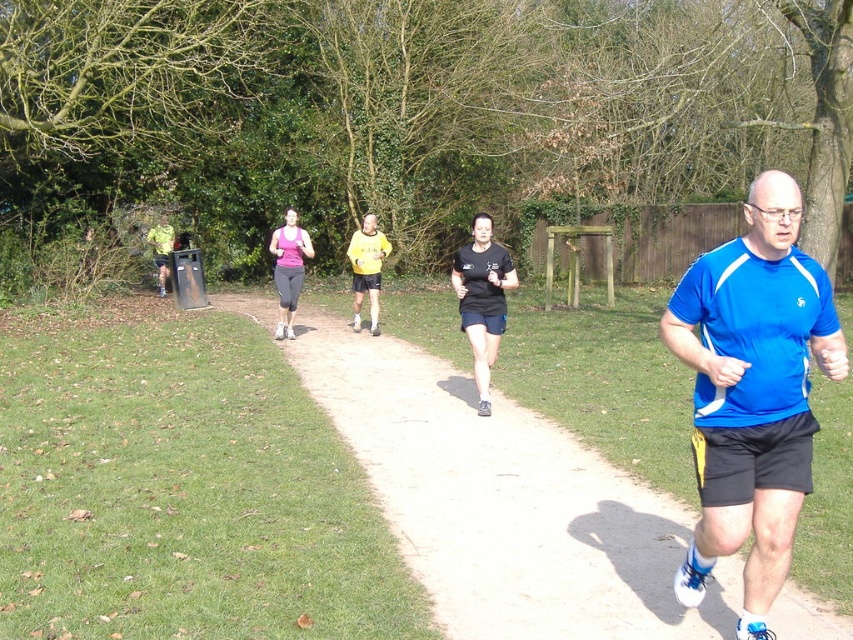
Is black matte running shoes at center below yellow jersey at center?

Yes, black matte running shoes at center is below yellow jersey at center.

Can you confirm if black matte running shoes at center is positioned to the left of yellow jersey at center?

Incorrect, black matte running shoes at center is not on the left side of yellow jersey at center.

Identify the location of black matte running shoes at center. This screenshot has width=853, height=640. (482, 300).

Who is more distant from viewer, [776,396] or [305,241]?

The point [305,241] is more distant.

Which is more to the right, blue fabric shirt at center or matte pink tank top at center?

From the viewer's perspective, blue fabric shirt at center appears more on the right side.

This screenshot has width=853, height=640. Identify the location of blue fabric shirt at center. (752, 392).

The height and width of the screenshot is (640, 853). Describe the element at coordinates (752, 392) in the screenshot. I see `blue fabric shirt at center` at that location.

From the picture: Is blue fabric shirt at center below yellow jersey at center?

Yes.

Who is more forward, (804, 323) or (367, 212)?

Point (804, 323) is in front.

Where is `blue fabric shirt at center`? The height and width of the screenshot is (640, 853). blue fabric shirt at center is located at coordinates (752, 392).